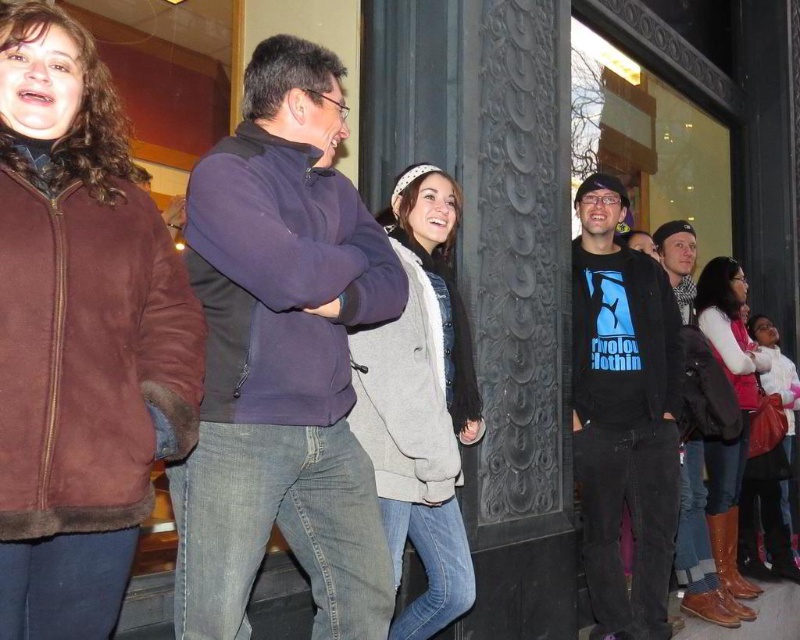
Is dark blue fleece at center in front of white fleece jacket at lower right?

Yes.

Can you confirm if dark blue fleece at center is thinner than white fleece jacket at lower right?

In fact, dark blue fleece at center might be wider than white fleece jacket at lower right.

Who is more distant from viewer, (390, 292) or (796, 554)?

Positioned behind is point (796, 554).

This screenshot has height=640, width=800. Find the location of `dark blue fleece at center`. dark blue fleece at center is located at coordinates (282, 358).

Does dark blue fleece at center appear over brown leather boots at lower right?

Yes.

Is dark blue fleece at center taller than brown leather boots at lower right?

In fact, dark blue fleece at center may be shorter than brown leather boots at lower right.

Describe the element at coordinates (282, 358) in the screenshot. I see `dark blue fleece at center` at that location.

At what (x,y) coordinates should I click in order to perform the action: click on dark blue fleece at center. Please return your answer as a coordinate pair (x, y). The width and height of the screenshot is (800, 640). Looking at the image, I should click on (282, 358).

Can you confirm if light gray fleece jacket at center is shorter than brown leather jacket at right?

In fact, light gray fleece jacket at center may be taller than brown leather jacket at right.

Is light gray fleece jacket at center positioned at the back of brown leather jacket at right?

No, it is in front of brown leather jacket at right.

Is point (368, 428) positioned behind point (701, 522)?

That is False.

Where is `light gray fleece jacket at center`? The width and height of the screenshot is (800, 640). light gray fleece jacket at center is located at coordinates (421, 403).